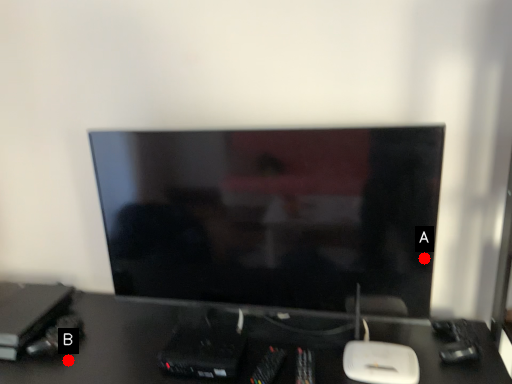
Question: Two points are circled on the image, labeled by A and B beside each circle. Which point is farther to the camera?

Choices:
 (A) A is further
 (B) B is further

Answer: (B)